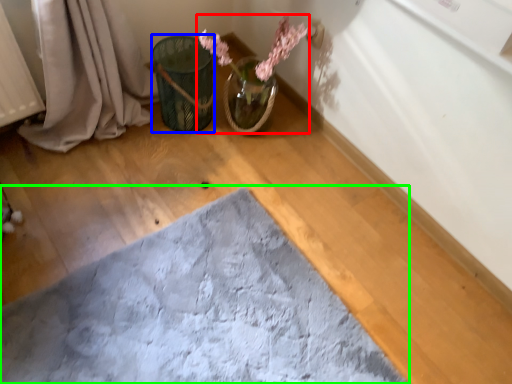
Question: Estimate the real-world distances between objects in this image. Which object is farther from floral arrangement (highlighted by a red box), flower basket (highlighted by a blue box) or bath mat (highlighted by a green box)?

Choices:
 (A) flower basket
 (B) bath mat

Answer: (B)